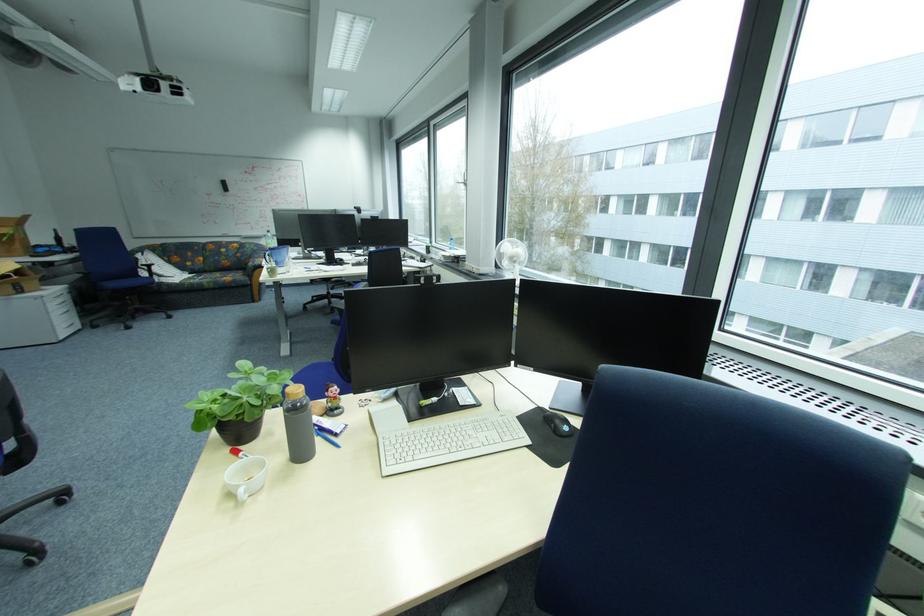
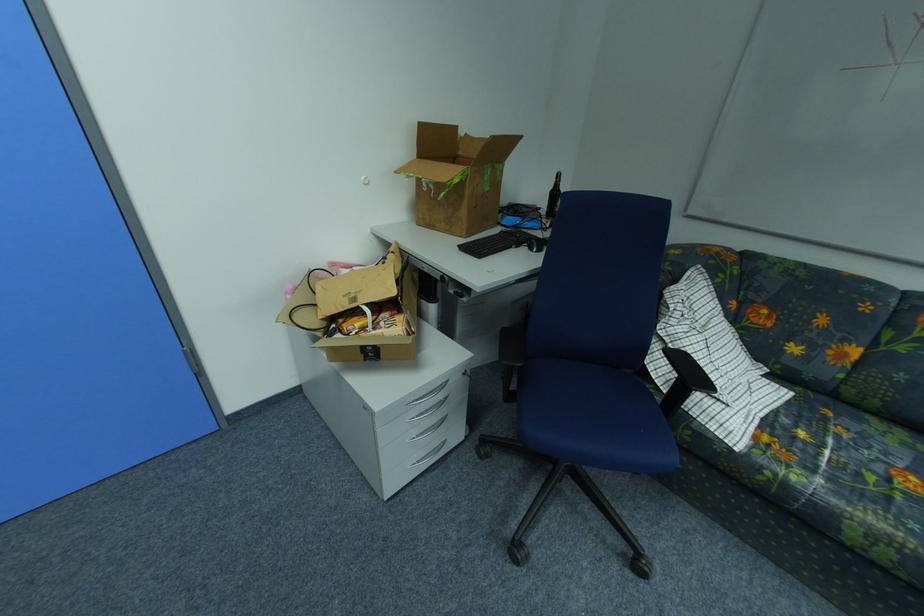
Locate, in the second image, the point that corresponds to pixel 27 246 in the first image.

(470, 214)